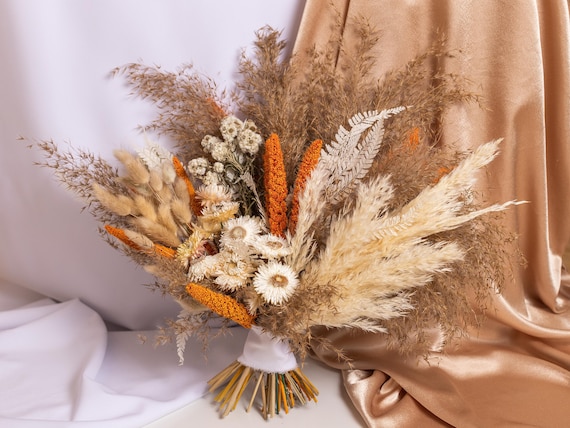
Locate an element on the screen. gold fabric backdrop is located at coordinates (481, 24).